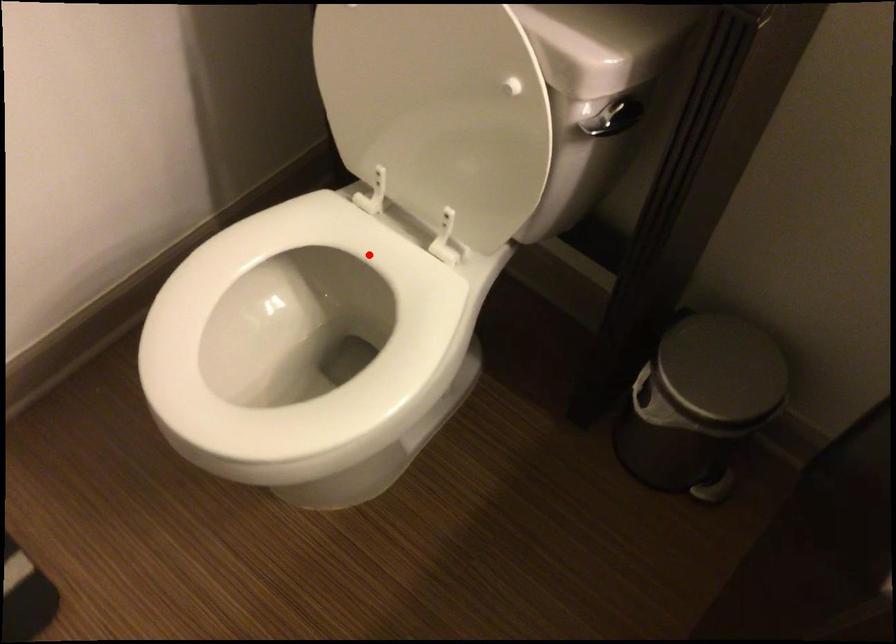
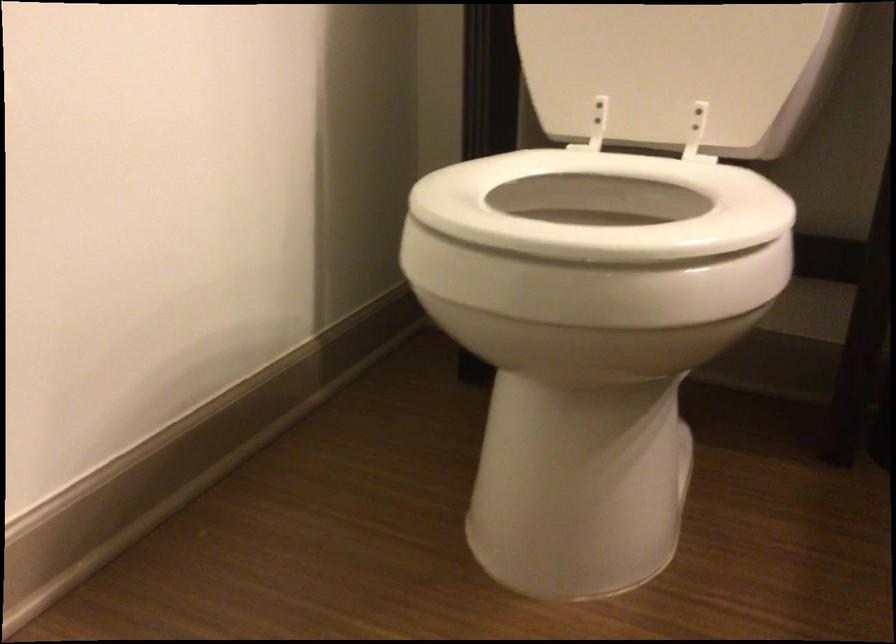
In the second image, find the point that corresponds to the highlighted location in the first image.

(602, 205)